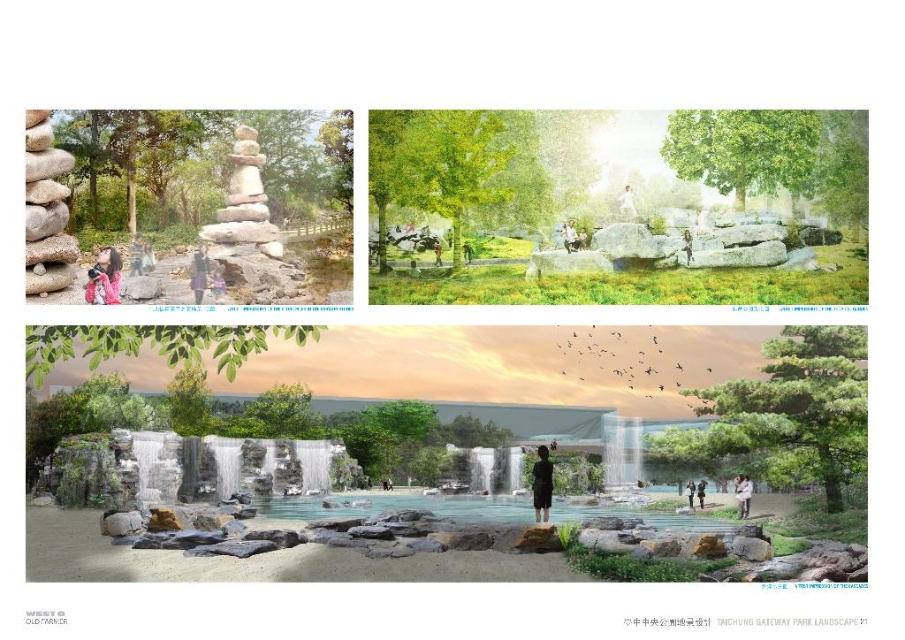
Question: Which point is farther to the camera?

Choices:
 (A) (561, 234)
 (B) (625, 204)

Answer: (A)

Question: Which object appears closest to the camera in this image?

Choices:
 (A) white cotton dress at center
 (B) pink fabric at upper left
 (C) clear glass waterfall at center
 (D) smooth gray stone waterfall at center

Answer: (B)

Question: Does light brown wooden bench at upper center lie behind dark gray fabric umbrella at center?

Choices:
 (A) yes
 (B) no

Answer: (B)

Question: Observing the image, what is the correct spatial positioning of gray stone waterfall at center in reference to clear glass waterfall at center?

Choices:
 (A) left
 (B) right

Answer: (A)

Question: Which point is farther to the camera?

Choices:
 (A) smooth gray rocks at center
 (B) pink fabric at upper left
 (C) green leafy tree at center

Answer: (C)

Question: Is black matte dress at center wider than light brown wooden bench at upper center?

Choices:
 (A) yes
 (B) no

Answer: (A)